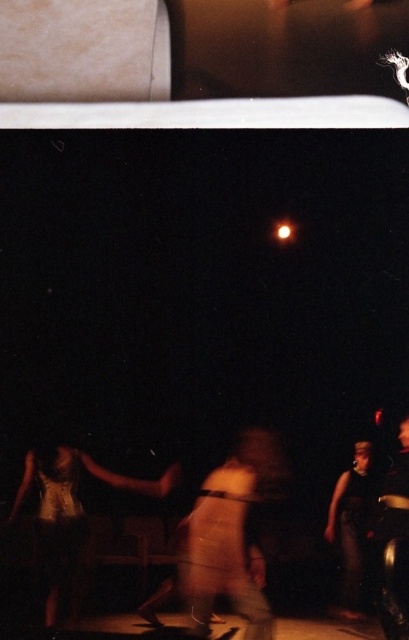
Based on the photo, you are at a nighttime event and need to locate your two outfits displayed in the image. The smooth beige pants at center and the gold metallic dress at lower left are part of your collection. According to their positions, which outfit is closer to the right side of the display?

The smooth beige pants at center are positioned to the right of the gold metallic dress at lower left, so the smooth beige pants at center are closer to the right side of the display.

You are standing in the lower section of the image where the night scene is. You need to place a small decorative item exactly where the smooth beige pants at center are located. What are the coordinates where you should place it?

The coordinates for placing the decorative item should be at point (231, 536), which is the 2D location of the smooth beige pants at center.